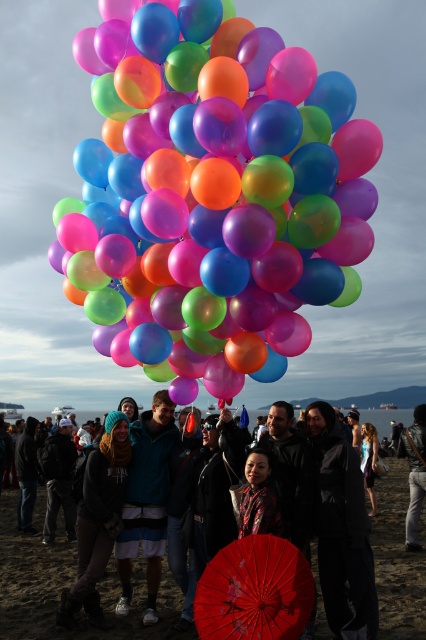
You are a photographer trying to capture a clear shot of the matte black hoodie at center without the red paper umbrella at center blocking it. The camera can focus on objects within a 1.5 meter range. Is the distance between them sufficient for you to move closer to the hoodie and still have the umbrella out of frame?

The red paper umbrella at center is 2.33 meters away from the matte black hoodie at center. Since the camera can focus within a 1.5 meter range, moving closer to the hoodie while keeping the umbrella out of frame would require maintaining at least 1.5 meters between them. However, the current distance is 2.33 meters, which is greater than 1.5 meters. Therefore, you can move closer to the matte black hoodie at center to reduce the distance to within 1.5 meters and still have the red paper umbrella at center

You are a photographer trying to capture a group photo of the black waterproof jacket at center and the denim jacket at lower right. The camera frame can only accommodate objects that are within a 30 cm width difference. Can both jackets fit in the frame together?

The black waterproof jacket at center might be wider than denim jacket at lower right. However, since the width difference is not specified, it is uncertain whether they can fit within the 30 cm constraint. Further measurement is needed to confirm.